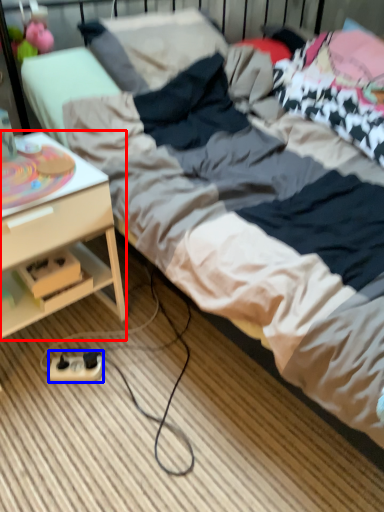
Question: Which point is further to the camera, desk (highlighted by a red box) or extension cord (highlighted by a blue box)?

Choices:
 (A) desk
 (B) extension cord

Answer: (B)